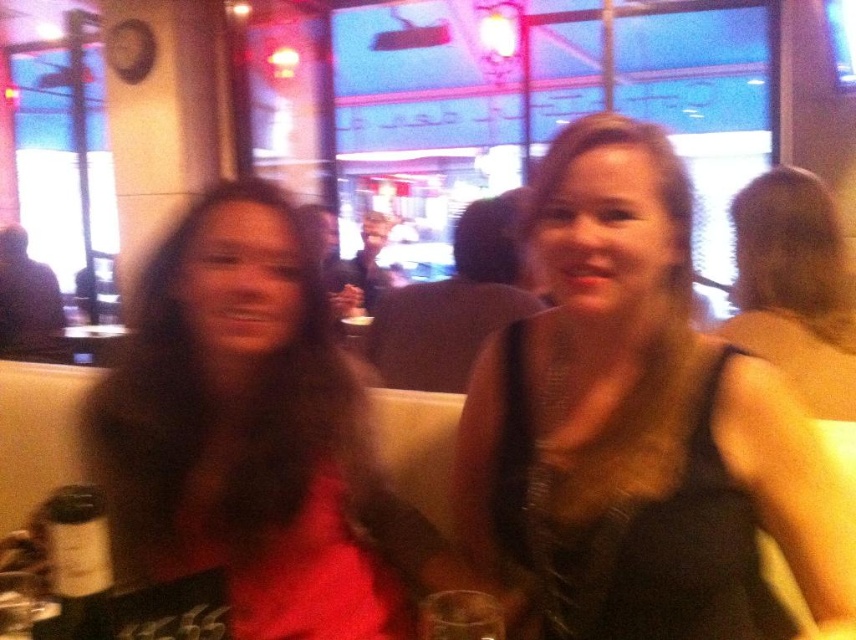
Which of these two, black sequined dress at center or matte black dress at center, stands shorter?

Standing shorter between the two is matte black dress at center.

Who is more distant from viewer, (646, 180) or (242, 376)?

The point (242, 376) is behind.

Who is more distant from viewer, (774, 408) or (336, 516)?

Point (336, 516)

Locate an element on the screen. Image resolution: width=856 pixels, height=640 pixels. black sequined dress at center is located at coordinates (637, 426).

Looking at this image, which is below, black sequined dress at center or dark brown glass bottle at lower left?

dark brown glass bottle at lower left is below.

Can you confirm if black sequined dress at center is positioned below dark brown glass bottle at lower left?

No, black sequined dress at center is not below dark brown glass bottle at lower left.

Is point (535, 621) behind point (82, 570)?

Yes, point (535, 621) is farther from viewer.

In order to click on black sequined dress at center in this screenshot , I will do `click(637, 426)`.

Is matte black dress at center further to the viewer compared to dark brown glass bottle at lower left?

Yes, it is behind dark brown glass bottle at lower left.

Find the location of `matte black dress at center`. matte black dress at center is located at coordinates (254, 436).